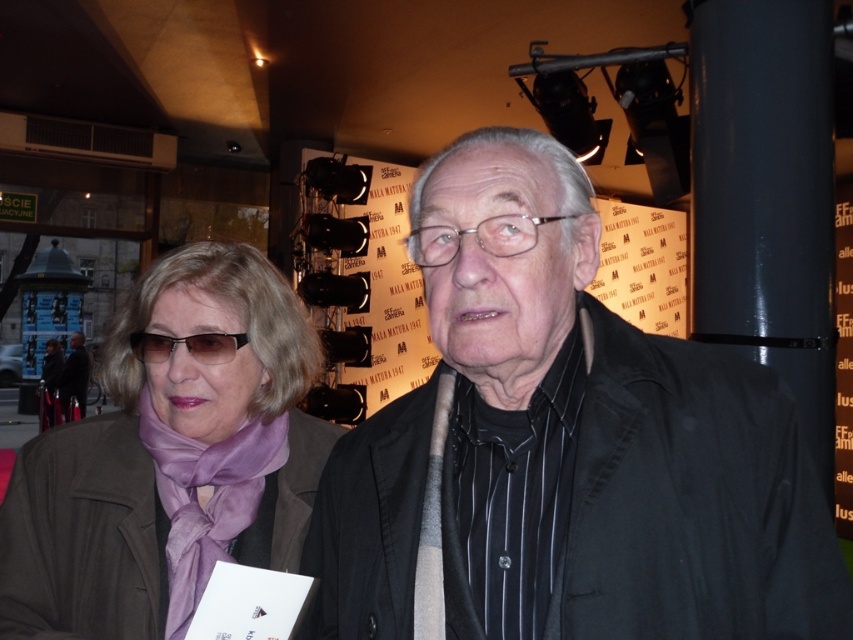
Which is behind, point (126, 364) or point (138, 346)?

The point (126, 364) is behind.

Identify the location of matte purple scarf at center. (169, 460).

Does black matte jacket at center have a smaller size compared to matte black glasses at center?

Actually, black matte jacket at center might be larger than matte black glasses at center.

Can you confirm if black matte jacket at center is positioned to the right of matte black glasses at center?

Correct, you'll find black matte jacket at center to the right of matte black glasses at center.

Is point (692, 387) positioned in front of point (192, 352)?

Yes.

Where is `black matte jacket at center`? Image resolution: width=853 pixels, height=640 pixels. black matte jacket at center is located at coordinates tap(567, 448).

Does matte purple scarf at center have a lesser width compared to matte black jacket at center?

Correct, matte purple scarf at center's width is less than matte black jacket at center's.

What are the coordinates of `matte purple scarf at center` in the screenshot? It's located at (169, 460).

The height and width of the screenshot is (640, 853). Describe the element at coordinates (169, 460) in the screenshot. I see `matte purple scarf at center` at that location.

You are a GUI agent. You are given a task and a screenshot of the screen. Output one action in this format:
    pyautogui.click(x=<x>, y=<y>)
    Task: Click on the matte purple scarf at center
    
    Given the screenshot: What is the action you would take?
    pyautogui.click(x=169, y=460)